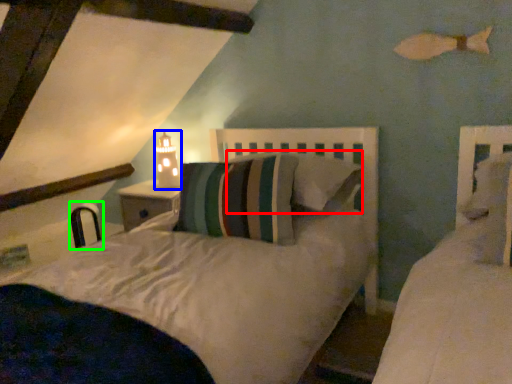
Question: Estimate the real-world distances between objects in this image. Which object is closer to pillow (highlighted by a red box), table lamp (highlighted by a blue box) or chair (highlighted by a green box)?

Choices:
 (A) table lamp
 (B) chair

Answer: (A)